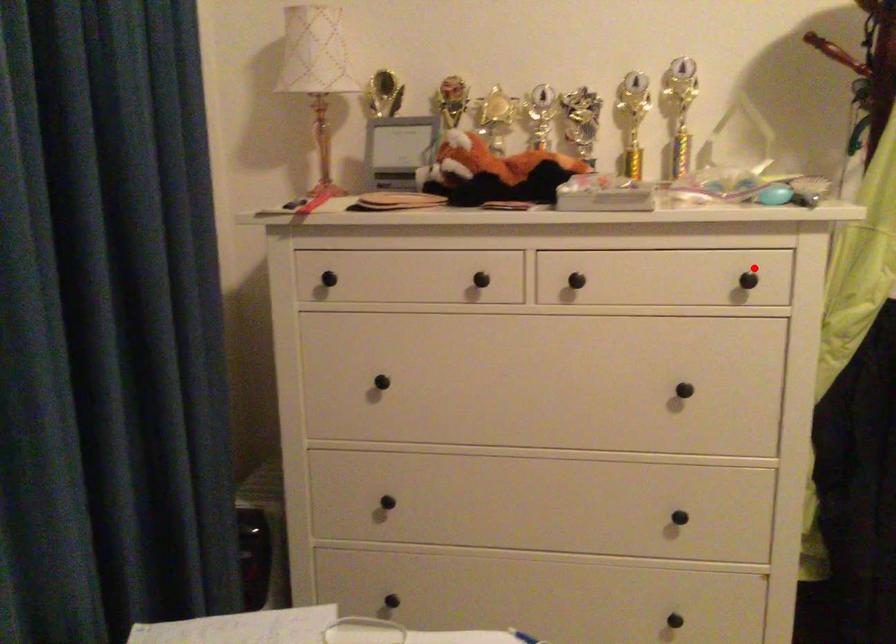
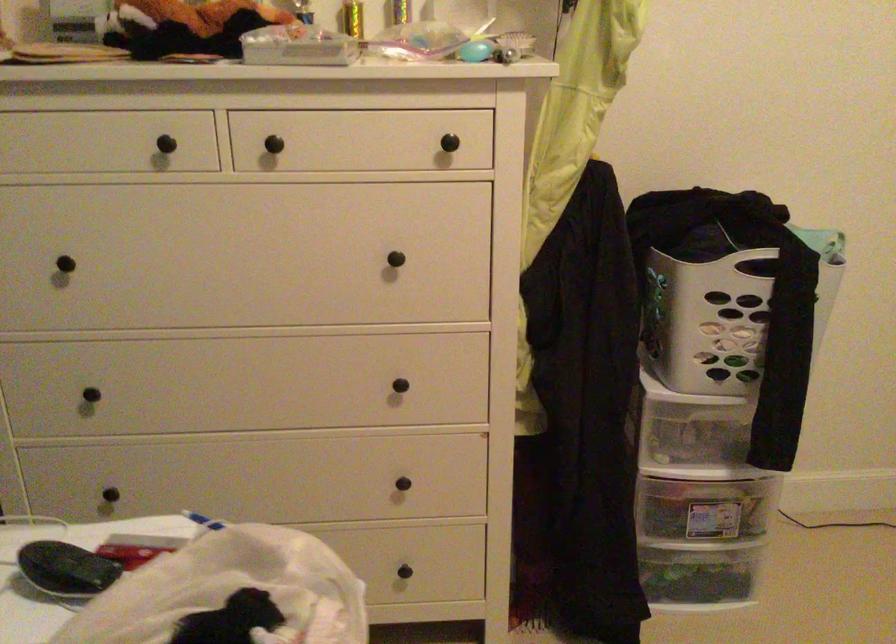
Where in the second image is the point corresponding to the highlighted location from the first image?

(453, 128)